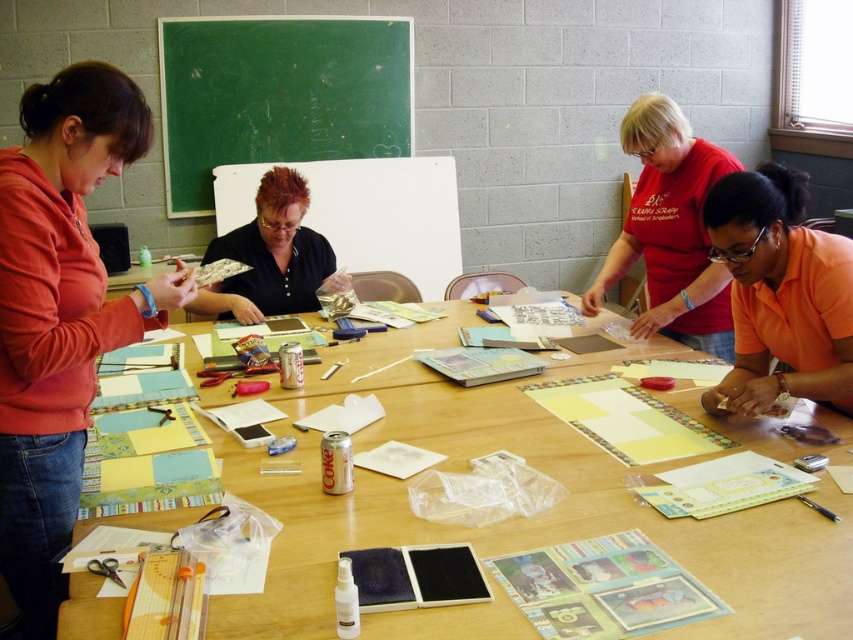
Is green chalkboard at upper center in front of orange matte shirt at lower right?

No, green chalkboard at upper center is behind orange matte shirt at lower right.

Does green chalkboard at upper center appear on the left side of orange matte shirt at lower right?

Yes, green chalkboard at upper center is to the left of orange matte shirt at lower right.

The image size is (853, 640). I want to click on green chalkboard at upper center, so [277, 96].

At what (x,y) coordinates should I click in order to perform the action: click on wooden table at center. Please return your answer as a coordinate pair (x, y). Image resolution: width=853 pixels, height=640 pixels. Looking at the image, I should click on (520, 516).

Who is more distant from viewer, (316, 376) or (270, 289)?

The point (270, 289) is more distant.

Is point (846, 570) positioned in front of point (238, 244)?

Yes, point (846, 570) is in front of point (238, 244).

Image resolution: width=853 pixels, height=640 pixels. Find the location of `wooden table at center`. wooden table at center is located at coordinates (520, 516).

How far apart are matte red shirt at center and shiny black shirt at center?

matte red shirt at center and shiny black shirt at center are 3.90 feet apart from each other.

Is matte red shirt at center taller than shiny black shirt at center?

Yes.

Measure the distance between point (669, 326) and camera.

Point (669, 326) and camera are 8.53 feet apart from each other.

Locate an element on the screen. The height and width of the screenshot is (640, 853). matte red shirt at center is located at coordinates (670, 230).